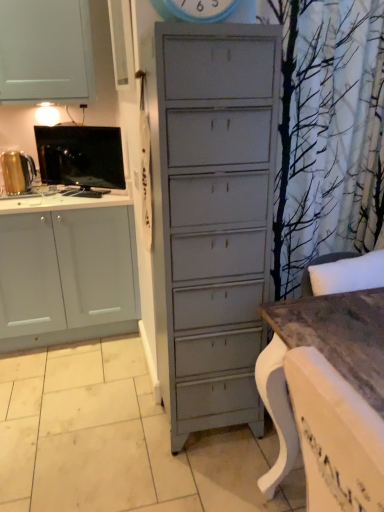
Question: Does wooden table at lower right come in front of black glossy tv at left, arranged as the first appliance when viewed from the right?

Choices:
 (A) yes
 (B) no

Answer: (A)

Question: Is wooden table at lower right to the left of black glossy tv at left, arranged as the first appliance when viewed from the right, from the viewer's perspective?

Choices:
 (A) no
 (B) yes

Answer: (A)

Question: From the image's perspective, is wooden table at lower right on black glossy tv at left, arranged as the first appliance when viewed from the right?

Choices:
 (A) no
 (B) yes

Answer: (A)

Question: Would you say black glossy tv at left, the 2th appliance from the left, is part of wooden table at lower right's contents?

Choices:
 (A) no
 (B) yes

Answer: (A)

Question: From the image's perspective, does wooden table at lower right appear lower than black glossy tv at left, the 2th appliance from the left?

Choices:
 (A) yes
 (B) no

Answer: (A)

Question: Do you think wooden table at lower right is within black glossy tv at left, arranged as the first appliance when viewed from the right, or outside of it?

Choices:
 (A) inside
 (B) outside

Answer: (B)

Question: In the image, is wooden table at lower right on the left side or the right side of black glossy tv at left, the 2th appliance from the left?

Choices:
 (A) left
 (B) right

Answer: (B)

Question: Considering the positions of wooden table at lower right and black glossy tv at left, arranged as the first appliance when viewed from the right, in the image, is wooden table at lower right bigger or smaller than black glossy tv at left, arranged as the first appliance when viewed from the right,?

Choices:
 (A) small
 (B) big

Answer: (B)

Question: In terms of height, does wooden table at lower right look taller or shorter compared to black glossy tv at left, arranged as the first appliance when viewed from the right?

Choices:
 (A) short
 (B) tall

Answer: (B)

Question: Is point (332, 326) positioned closer to the camera than point (24, 181)?

Choices:
 (A) farther
 (B) closer

Answer: (B)

Question: Relative to gold metallic kettle at left, the 2th appliance positioned from the right, is wooden table at lower right in front or behind?

Choices:
 (A) front
 (B) behind

Answer: (A)

Question: In terms of width, does wooden table at lower right look wider or thinner when compared to gold metallic kettle at left, the 2th appliance positioned from the right?

Choices:
 (A) thin
 (B) wide

Answer: (B)

Question: Considering the relative positions of wooden table at lower right and gold metallic kettle at left, the 2th appliance positioned from the right, in the image provided, is wooden table at lower right to the left or to the right of gold metallic kettle at left, the 2th appliance positioned from the right,?

Choices:
 (A) right
 (B) left

Answer: (A)

Question: From a real-world perspective, is black glossy tv at left, the 2th appliance from the left, physically located above or below gold metallic kettle at left, which ranks as the first appliance in left-to-right order?

Choices:
 (A) above
 (B) below

Answer: (A)

Question: Is black glossy tv at left, arranged as the first appliance when viewed from the right, bigger or smaller than gold metallic kettle at left, which ranks as the first appliance in left-to-right order?

Choices:
 (A) small
 (B) big

Answer: (B)